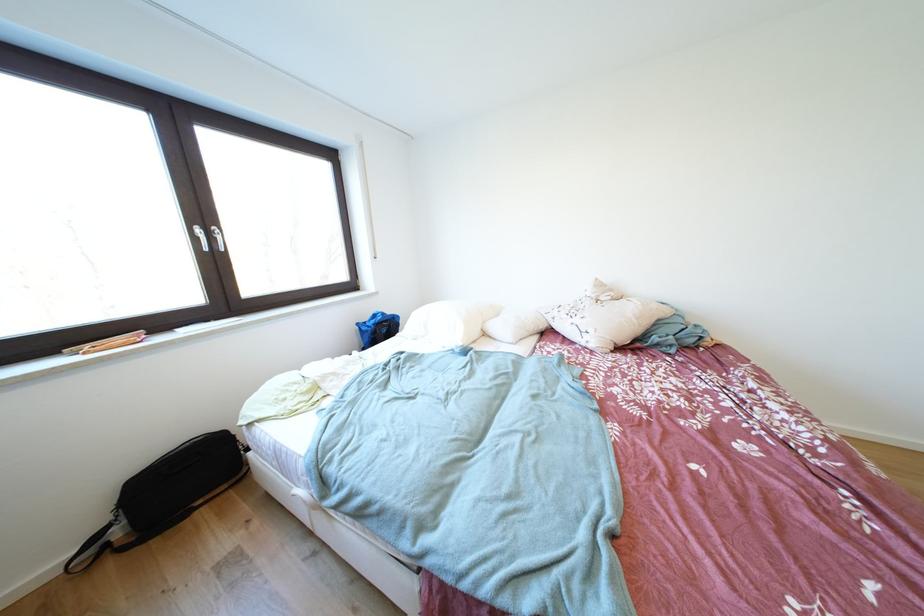
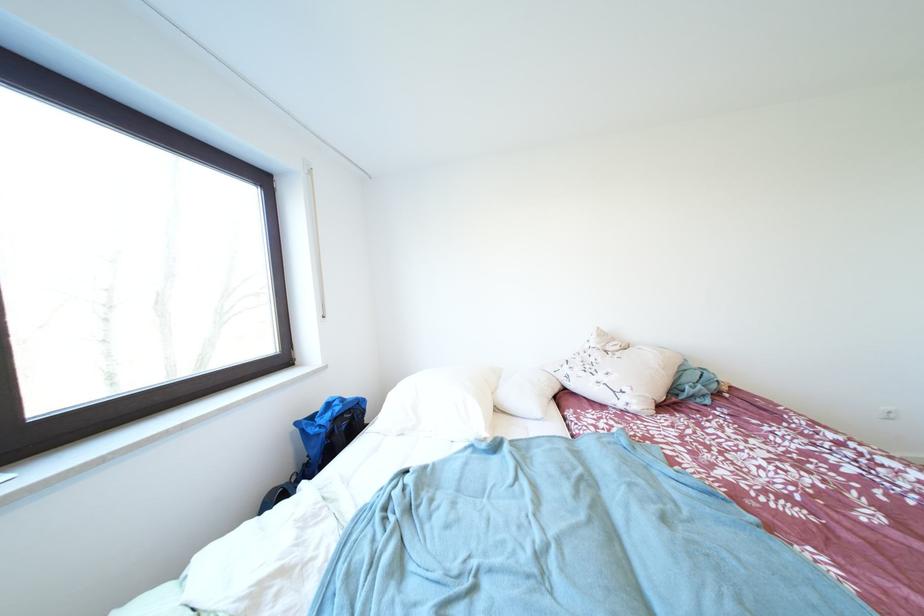
Find the pixel in the second image that matches the point at 503,331 in the first image.

(517, 403)